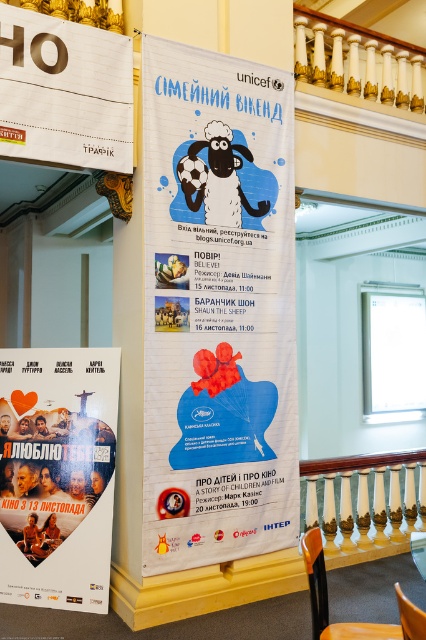
You are standing in the hall and want to read the wooden sign at upper left. Can you read it clearly without moving closer?

The wooden sign at upper left is 11.52 feet from viewer, so yes, you can read it clearly without moving closer since it is at a reasonable distance.

You are standing in the hall and want to sit down. You see an orange plastic chair at lower right and a brown wooden chair at lower right. Which chair is closer to you?

The orange plastic chair at lower right is closer to you because it is further to the viewer than the brown wooden chair at lower right.

You are a visitor standing in the hall and want to know which object is taller between the wooden sign at upper left and the brown wooden chair at lower right. Based on the scene description, can you determine which one is taller?

The wooden sign at upper left is much taller than the brown wooden chair at lower right.